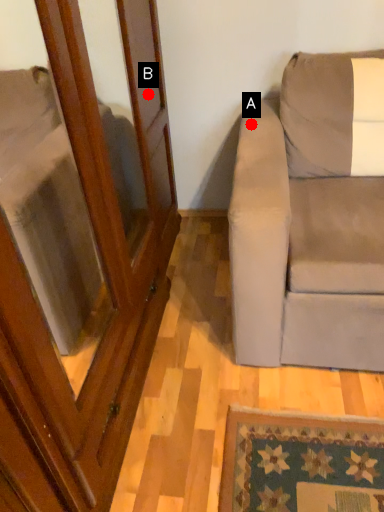
Question: Two points are circled on the image, labeled by A and B beside each circle. Among these points, which one is nearest to the camera?

Choices:
 (A) A is closer
 (B) B is closer

Answer: (B)